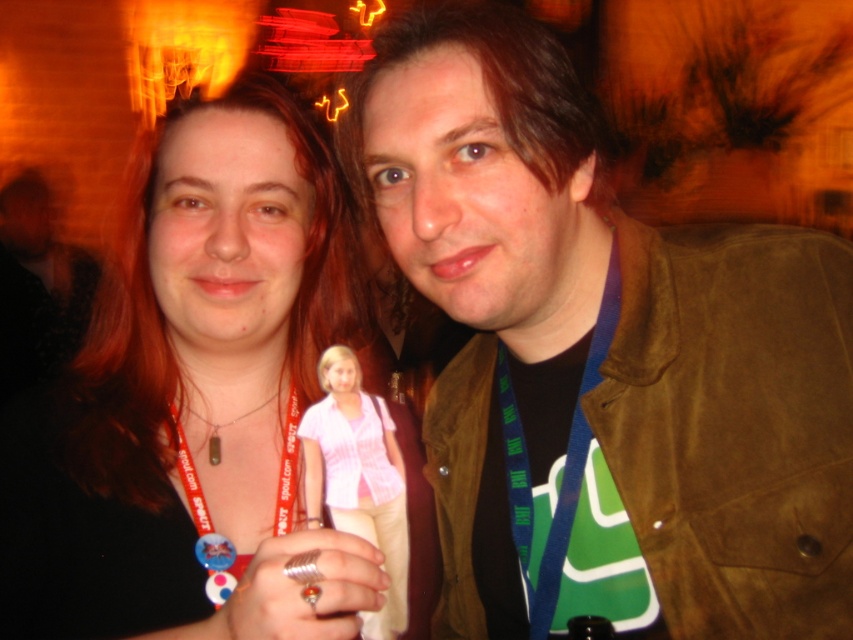
Can you confirm if brown suede jacket at center is wider than matte black necklace at center?

Yes.

Is brown suede jacket at center smaller than matte black necklace at center?

Correct, brown suede jacket at center occupies less space than matte black necklace at center.

Is point (606, 401) farther from viewer compared to point (19, 440)?

That is False.

This screenshot has width=853, height=640. What are the coordinates of `brown suede jacket at center` in the screenshot? It's located at (605, 356).

Who is higher up, matte black necklace at center or pink fabric shirt at center?

matte black necklace at center

Who is more forward, (9, 444) or (381, 500)?

Positioned in front is point (381, 500).

Who is more distant from viewer, (366,316) or (357,465)?

The point (366,316) is behind.

The width and height of the screenshot is (853, 640). In order to click on matte black necklace at center in this screenshot , I will do `click(193, 397)`.

Who is taller, brown suede jacket at center or pink fabric shirt at center?

Standing taller between the two is brown suede jacket at center.

Does point (408, 196) come behind point (312, 444)?

Yes, point (408, 196) is behind point (312, 444).

Describe the element at coordinates (605, 356) in the screenshot. I see `brown suede jacket at center` at that location.

Find the location of a particular element. This screenshot has height=640, width=853. brown suede jacket at center is located at coordinates (605, 356).